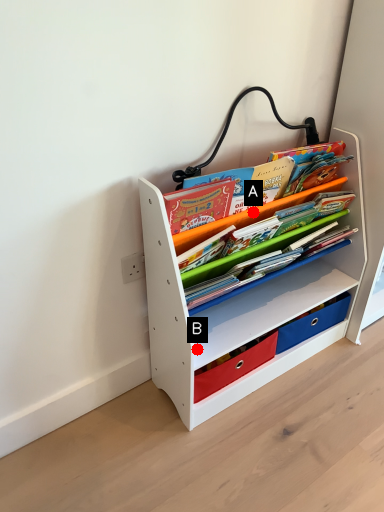
Question: Two points are circled on the image, labeled by A and B beside each circle. Which point is closer to the camera?

Choices:
 (A) A is closer
 (B) B is closer

Answer: (B)